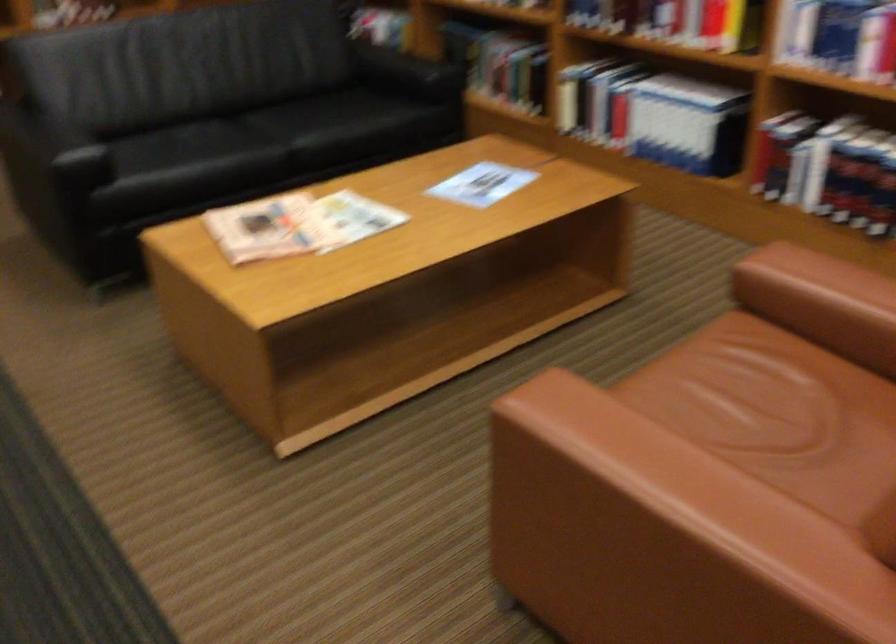
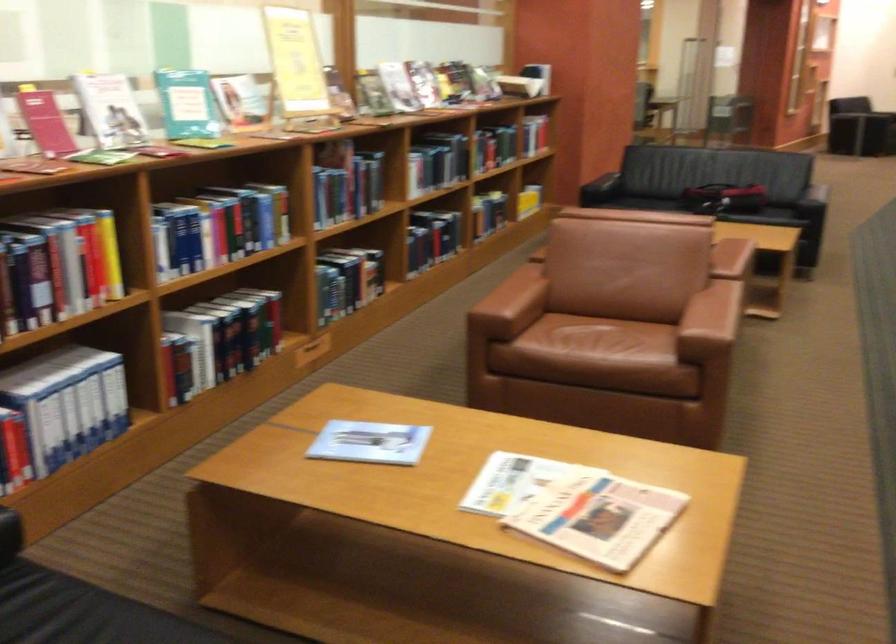
Question: I am providing you with two images of the same scene from different viewpoints. Please identify which objects are invisible in image2.

Choices:
 (A) sofa sitting surface
 (B) folded newspaper
 (C) recessed drawer pull
 (D) none of these

Answer: (D)